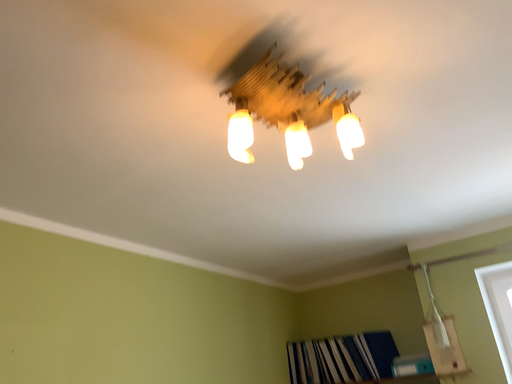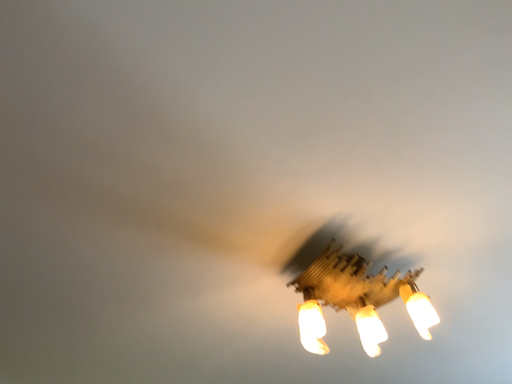
Question: How did the camera likely rotate when shooting the video?

Choices:
 (A) rotated upward
 (B) rotated downward

Answer: (A)